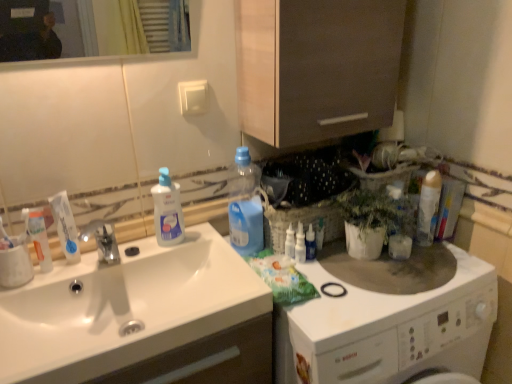
Question: Considering their positions, is translucent plastic bottle at upper center, which is the second cleaning product in left-to-right order, located in front of or behind white glossy toothpaste at left?

Choices:
 (A) behind
 (B) front

Answer: (A)

Question: Is translucent plastic bottle at upper center, which is the second cleaning product in left-to-right order, situated inside white glossy toothpaste at left or outside?

Choices:
 (A) inside
 (B) outside

Answer: (B)

Question: Which of these objects is positioned closest to the clear plastic bottle at sink, which appears as the first cleaning product when viewed from the left?

Choices:
 (A) translucent plastic bottles at center, placed as the third toiletry when sorted from right to left
 (B) transparent plastic bottle at upper right
 (C) white matte aerosol can at upper right, marked as the first cleaning product in a right-to-left arrangement
 (D) translucent plastic bottle at upper center, which is the 2th cleaning product from right to left
 (E) white glossy washing machine at right

Answer: (D)

Question: Which of these objects is positioned farthest from the brown wood cabinet at upper center?

Choices:
 (A) translucent plastic bottles at center, the 2th toiletry when ordered from left to right
 (B) white matte toothpaste tube at left, which is the 1th toiletry in left-to-right order
 (C) white glossy washing machine at right
 (D) clear plastic bottle at sink, which ranks as the third cleaning product in right-to-left order
 (E) white glossy toothpaste at left

Answer: (B)